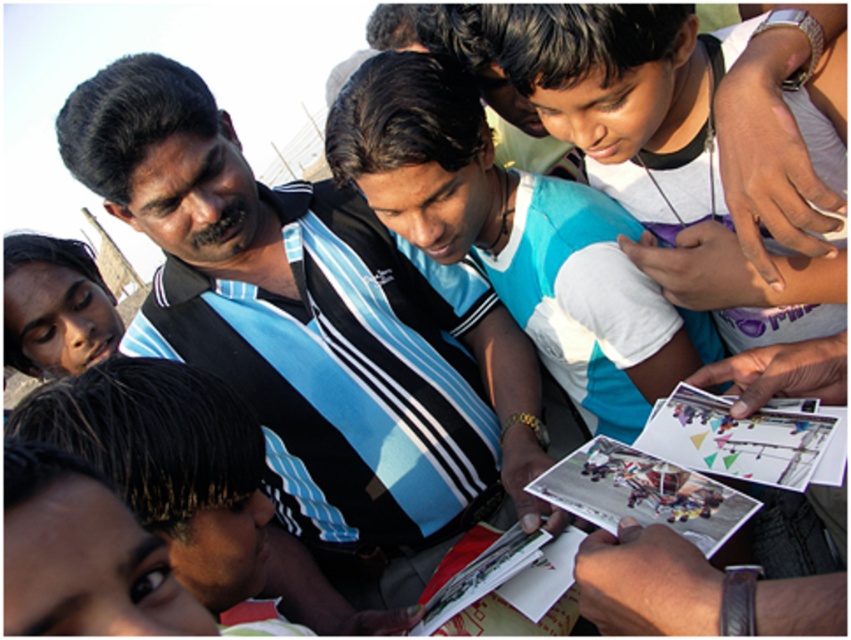
You are organizing a photo display and need to arrange the printed paper postcards at center and the printed paper postcard at center. Which one should you place first if you want to arrange them from smallest to largest?

The printed paper postcards at center should be placed first because it has a smaller size compared to the printed paper postcard at center.

You are a photographer trying to capture a closeup of the printed paper postcard at center without including the black striped shirt at center in the frame. Based on their sizes, which object should you focus on to ensure the postcard is fully visible and the shirt is out of view?

The black striped shirt at center is larger in size than the printed paper postcard at center. To capture the postcard without the shirt, focus on the smaller printed paper postcard at center and frame the shot to exclude the larger black striped shirt at center.

You are taking a photo of the group and want to focus on both the point at (820, 461) and the point at (729, 522). Which point is closer to the camera?

Point (729, 522) is closer to the camera than point (820, 461).